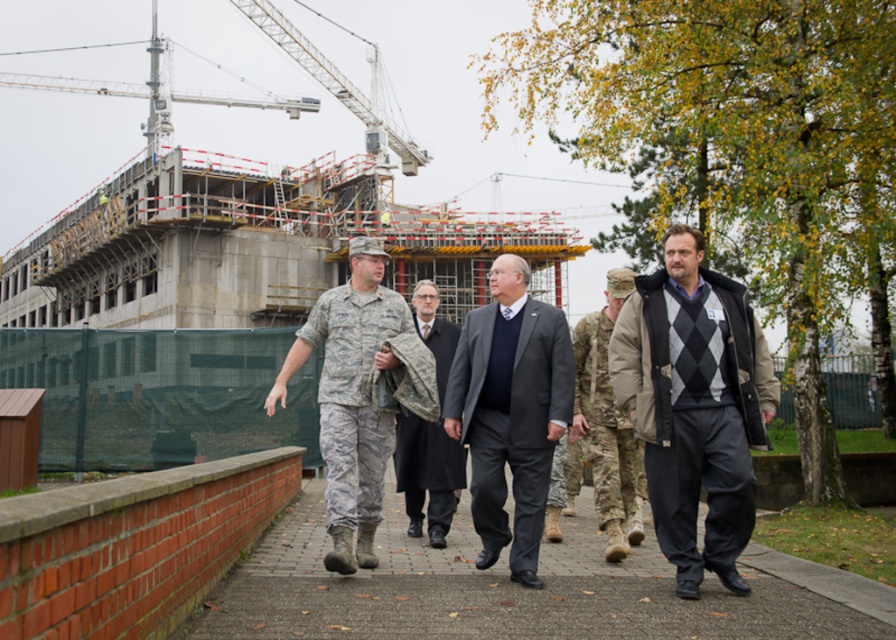
Which is above, gray concrete pavement at center or dark gray suit at center?

dark gray suit at center is higher up.

Who is more distant from viewer, (x=834, y=611) or (x=541, y=369)?

The point (x=541, y=369) is more distant.

Who is more forward, (452,538) or (513,269)?

Point (513,269) is in front.

Find the location of a particular element. Image resolution: width=896 pixels, height=640 pixels. gray concrete pavement at center is located at coordinates (511, 589).

Can you confirm if gray concrete pavement at center is wider than camouflage uniform at center?

In fact, gray concrete pavement at center might be narrower than camouflage uniform at center.

What do you see at coordinates (511, 589) in the screenshot? The height and width of the screenshot is (640, 896). I see `gray concrete pavement at center` at bounding box center [511, 589].

Locate an element on the screen. This screenshot has width=896, height=640. gray concrete pavement at center is located at coordinates (511, 589).

Is gray concrete pavement at center positioned in front of dark gray wool suit at center?

Yes, gray concrete pavement at center is in front of dark gray wool suit at center.

Does gray concrete pavement at center come behind dark gray wool suit at center?

No, it is in front of dark gray wool suit at center.

The height and width of the screenshot is (640, 896). What do you see at coordinates (511, 589) in the screenshot?
I see `gray concrete pavement at center` at bounding box center [511, 589].

Identify the location of gray concrete pavement at center. (511, 589).